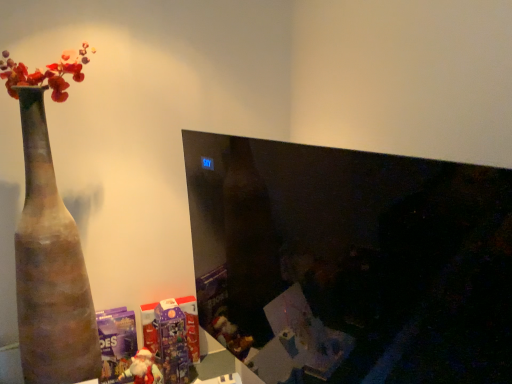
Where is `black glossy monitor at center`? black glossy monitor at center is located at coordinates (351, 262).

Image resolution: width=512 pixels, height=384 pixels. Describe the element at coordinates (50, 268) in the screenshot. I see `terracotta vase at left` at that location.

Measure the distance between point (149, 355) and camera.

They are 1.96 meters apart.

This screenshot has height=384, width=512. I want to click on black glossy monitor at center, so click(x=351, y=262).

From a real-world perspective, which is physically above, black glossy monitor at center or matte plastic santa at lower left, which ranks as the first toy in front-to-back order?

In real-world perspective, black glossy monitor at center is above.

Which is farther from the camera, (482,284) or (137,368)?

Point (137,368)

Are black glossy monitor at center and matte plastic santa at lower left, marked as the 2th toy in a back-to-front arrangement, making contact?

No, black glossy monitor at center is not in contact with matte plastic santa at lower left, marked as the 2th toy in a back-to-front arrangement.

From the image's perspective, which one is positioned lower, matte plastic santa at lower left, marked as the 2th toy in a back-to-front arrangement, or purple glossy advent calendar at lower center, the 2th toy when ordered from front to back?

matte plastic santa at lower left, marked as the 2th toy in a back-to-front arrangement, appears lower in the image.

Is matte plastic santa at lower left, marked as the 2th toy in a back-to-front arrangement, facing away from purple glossy advent calendar at lower center, the 1th toy viewed from the back?

matte plastic santa at lower left, marked as the 2th toy in a back-to-front arrangement, is not turned away from purple glossy advent calendar at lower center, the 1th toy viewed from the back.

Which object is positioned more to the left, matte plastic santa at lower left, marked as the 2th toy in a back-to-front arrangement, or purple glossy advent calendar at lower center, the 2th toy when ordered from front to back?

matte plastic santa at lower left, marked as the 2th toy in a back-to-front arrangement.

Can you confirm if matte plastic santa at lower left, marked as the 2th toy in a back-to-front arrangement, is bigger than purple glossy advent calendar at lower center, the 2th toy when ordered from front to back?

No.

Which is in front, purple glossy advent calendar at lower center, the 1th toy viewed from the back, or matte plastic santa at lower left, which ranks as the first toy in front-to-back order?

matte plastic santa at lower left, which ranks as the first toy in front-to-back order.

Is purple glossy advent calendar at lower center, the 1th toy viewed from the back, directly adjacent to matte plastic santa at lower left, marked as the 2th toy in a back-to-front arrangement?

purple glossy advent calendar at lower center, the 1th toy viewed from the back, is not next to matte plastic santa at lower left, marked as the 2th toy in a back-to-front arrangement, and they're not touching.

Which is in front, point (183, 356) or point (146, 377)?

The point (146, 377) is closer to the camera.

Would you say terracotta vase at left is a long distance from purple glossy advent calendar at lower center, the 1th toy viewed from the back?

That's not correct — terracotta vase at left is a little close to purple glossy advent calendar at lower center, the 1th toy viewed from the back.

Is terracotta vase at left positioned before purple glossy advent calendar at lower center, the 1th toy viewed from the back?

Yes.

Considering the sizes of objects terracotta vase at left and purple glossy advent calendar at lower center, the 2th toy when ordered from front to back, in the image provided, who is taller, terracotta vase at left or purple glossy advent calendar at lower center, the 2th toy when ordered from front to back,?

terracotta vase at left is taller.

Is terracotta vase at left not inside purple glossy advent calendar at lower center, the 2th toy when ordered from front to back?

That's correct, terracotta vase at left is outside of purple glossy advent calendar at lower center, the 2th toy when ordered from front to back.

How distant is black glossy monitor at center from terracotta vase at left?

The distance of black glossy monitor at center from terracotta vase at left is 31.54 inches.

Considering the points (248, 147) and (61, 227), which point is in front, point (248, 147) or point (61, 227)?

Positioned in front is point (248, 147).

In terms of width, does black glossy monitor at center look wider or thinner when compared to terracotta vase at left?

black glossy monitor at center is thinner than terracotta vase at left.

From a real-world perspective, is black glossy monitor at center positioned over terracotta vase at left based on gravity?

Yes, from a real-world perspective, black glossy monitor at center is over terracotta vase at left

Does terracotta vase at left have a greater width compared to matte plastic santa at lower left, which ranks as the first toy in front-to-back order?

Indeed, terracotta vase at left has a greater width compared to matte plastic santa at lower left, which ranks as the first toy in front-to-back order.

How different are the orientations of terracotta vase at left and matte plastic santa at lower left, marked as the 2th toy in a back-to-front arrangement, in degrees?

terracotta vase at left and matte plastic santa at lower left, marked as the 2th toy in a back-to-front arrangement, are facing 0.368 degrees away from each other.

How much distance is there between terracotta vase at left and matte plastic santa at lower left, which ranks as the first toy in front-to-back order?

A distance of 53.25 centimeters exists between terracotta vase at left and matte plastic santa at lower left, which ranks as the first toy in front-to-back order.

Considering their positions, is terracotta vase at left located in front of or behind matte plastic santa at lower left, marked as the 2th toy in a back-to-front arrangement?

Visually, terracotta vase at left is located in front of matte plastic santa at lower left, marked as the 2th toy in a back-to-front arrangement.

From the image's perspective, is purple glossy advent calendar at lower center, the 1th toy viewed from the back, under black glossy monitor at center?

Yes, from the image's perspective, purple glossy advent calendar at lower center, the 1th toy viewed from the back, is beneath black glossy monitor at center.

From a real-world perspective, between purple glossy advent calendar at lower center, the 1th toy viewed from the back, and black glossy monitor at center, who is vertically lower?

purple glossy advent calendar at lower center, the 1th toy viewed from the back.

Is purple glossy advent calendar at lower center, the 1th toy viewed from the back, bigger or smaller than black glossy monitor at center?

Considering their sizes, purple glossy advent calendar at lower center, the 1th toy viewed from the back, takes up less space than black glossy monitor at center.

At what (x,y) coordinates should I click in order to perform the action: click on the 2nd toy to the left of the black glossy monitor at center, starting your count from the anchor. Please return your answer as a coordinate pair (x, y). Looking at the image, I should click on (143, 369).

Identify the location of toy below the purple glossy advent calendar at lower center, the 2th toy when ordered from front to back (from a real-world perspective). The height and width of the screenshot is (384, 512). (143, 369).

Looking at the image, which one is located closer to purple glossy advent calendar at lower center, the 1th toy viewed from the back, black glossy monitor at center or terracotta vase at left?

Based on the image, terracotta vase at left appears to be nearer to purple glossy advent calendar at lower center, the 1th toy viewed from the back.

From the image, which object appears to be nearer to terracotta vase at left, black glossy monitor at center or purple glossy advent calendar at lower center, the 1th toy viewed from the back?

The object closer to terracotta vase at left is purple glossy advent calendar at lower center, the 1th toy viewed from the back.

Looking at this image, looking at the image, which one is located further to matte plastic santa at lower left, which ranks as the first toy in front-to-back order, terracotta vase at left or purple glossy advent calendar at lower center, the 2th toy when ordered from front to back?

Based on the image, terracotta vase at left appears to be further to matte plastic santa at lower left, which ranks as the first toy in front-to-back order.

Which object lies nearer to the anchor point matte plastic santa at lower left, marked as the 2th toy in a back-to-front arrangement, purple glossy advent calendar at lower center, the 2th toy when ordered from front to back, or terracotta vase at left?

purple glossy advent calendar at lower center, the 2th toy when ordered from front to back, lies closer to matte plastic santa at lower left, marked as the 2th toy in a back-to-front arrangement, than the other object.

Estimate the real-world distances between objects in this image. Which object is further from black glossy monitor at center, matte plastic santa at lower left, marked as the 2th toy in a back-to-front arrangement, or terracotta vase at left?

The object further to black glossy monitor at center is matte plastic santa at lower left, marked as the 2th toy in a back-to-front arrangement.

From the image, which object appears to be nearer to purple glossy advent calendar at lower center, the 2th toy when ordered from front to back, matte plastic santa at lower left, marked as the 2th toy in a back-to-front arrangement, or black glossy monitor at center?

matte plastic santa at lower left, marked as the 2th toy in a back-to-front arrangement, lies closer to purple glossy advent calendar at lower center, the 2th toy when ordered from front to back, than the other object.

Estimate the real-world distances between objects in this image. Which object is further from terracotta vase at left, black glossy monitor at center or matte plastic santa at lower left, marked as the 2th toy in a back-to-front arrangement?

black glossy monitor at center is further to terracotta vase at left.

Considering their positions, is matte plastic santa at lower left, marked as the 2th toy in a back-to-front arrangement, positioned further to terracotta vase at left than purple glossy advent calendar at lower center, the 1th toy viewed from the back?

Based on the image, matte plastic santa at lower left, marked as the 2th toy in a back-to-front arrangement, appears to be further to terracotta vase at left.

Identify the location of toy located between black glossy monitor at center and purple glossy advent calendar at lower center, the 1th toy viewed from the back, in the depth direction. (143, 369).

What are the coordinates of `vase between black glossy monitor at center and purple glossy advent calendar at lower center, the 1th toy viewed from the back, in the front-back direction` in the screenshot? It's located at (50, 268).

Locate an element on the screen. Image resolution: width=512 pixels, height=384 pixels. toy between terracotta vase at left and matte plastic santa at lower left, which ranks as the first toy in front-to-back order, from top to bottom is located at coordinates (172, 342).

At what (x,y) coordinates should I click in order to perform the action: click on vase between black glossy monitor at center and matte plastic santa at lower left, which ranks as the first toy in front-to-back order, in the front-back direction. Please return your answer as a coordinate pair (x, y). Image resolution: width=512 pixels, height=384 pixels. Looking at the image, I should click on (50, 268).